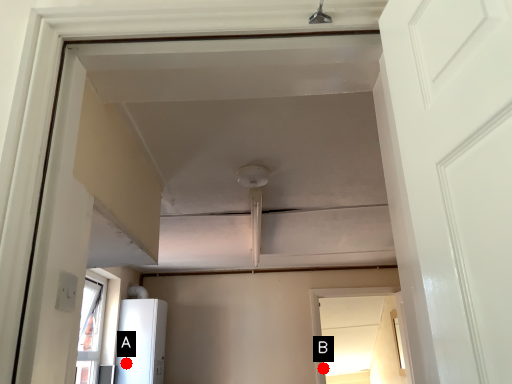
Question: Two points are circled on the image, labeled by A and B beside each circle. Which point is closer to the camera?

Choices:
 (A) A is closer
 (B) B is closer

Answer: (A)